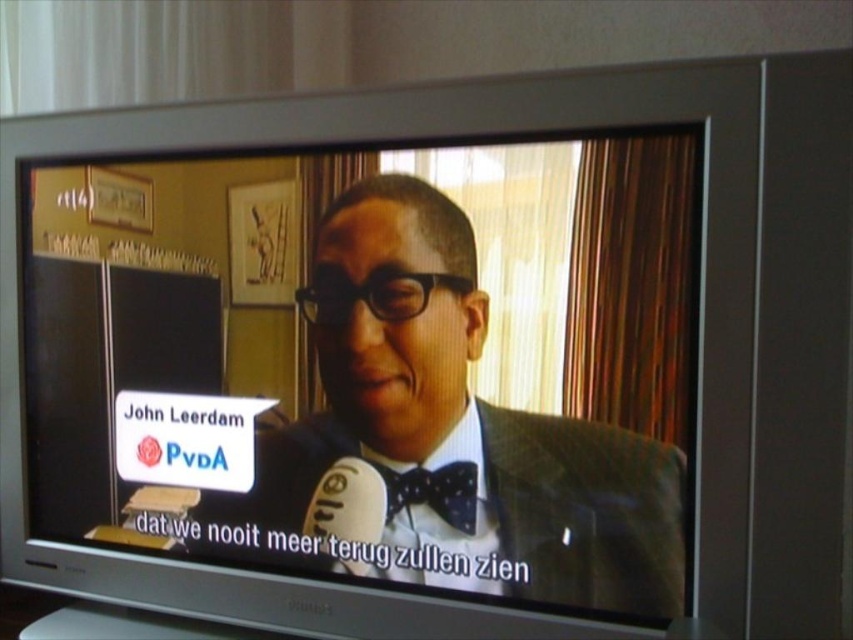
You are a fashion designer observing the speaker in the scene. You need to determine which item of clothing takes up more visual space on the television screen. Which one is larger between the polished dark suit at center and the black dotted bow tie at center?

The polished dark suit at center is bigger than the black dotted bow tie at center, so the polished dark suit at center takes up more visual space on the television screen.

What is the 2D coordinate of the polished dark suit at center?

The 2D coordinate of the polished dark suit at center is at point (456, 429).

In the scene shown: You are a fashion designer analyzing the outfit of a person on a TV screen. You notice the polished dark suit at center and the black dotted bow tie at center. Which item is closer to the camera?

The polished dark suit at center is closer to the camera because it is in front of the black dotted bow tie at center.